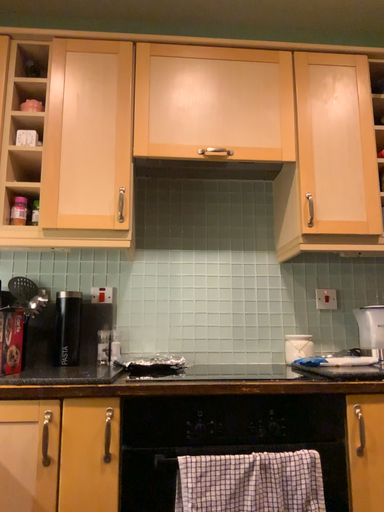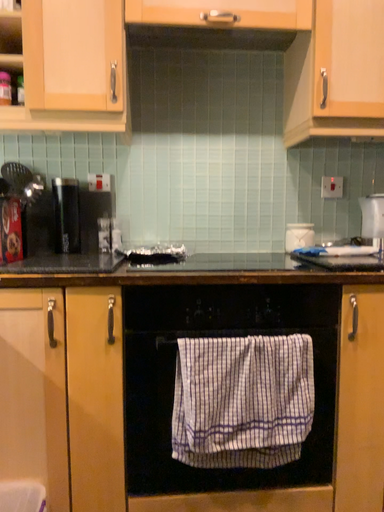
Question: Which way did the camera rotate in the video?

Choices:
 (A) rotated upward
 (B) rotated downward

Answer: (B)